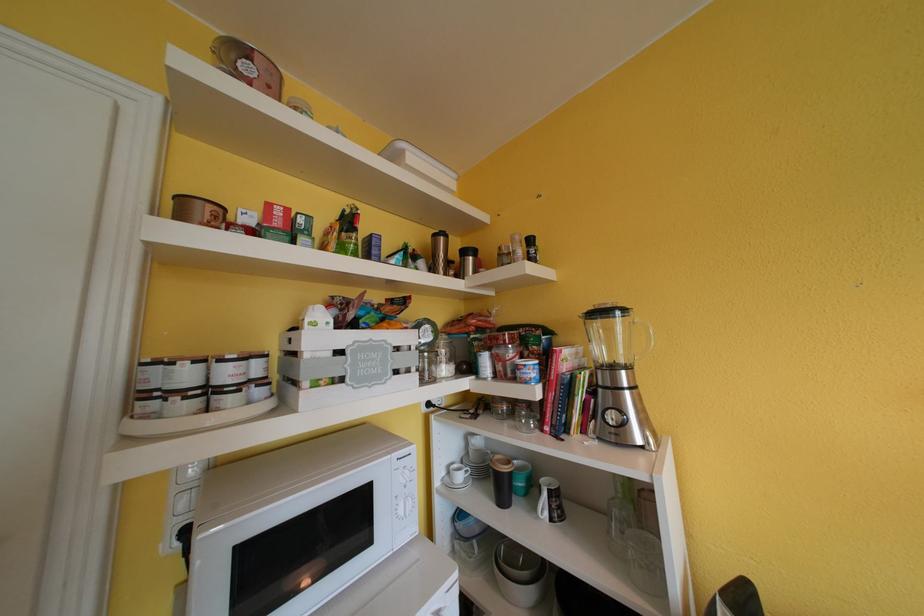
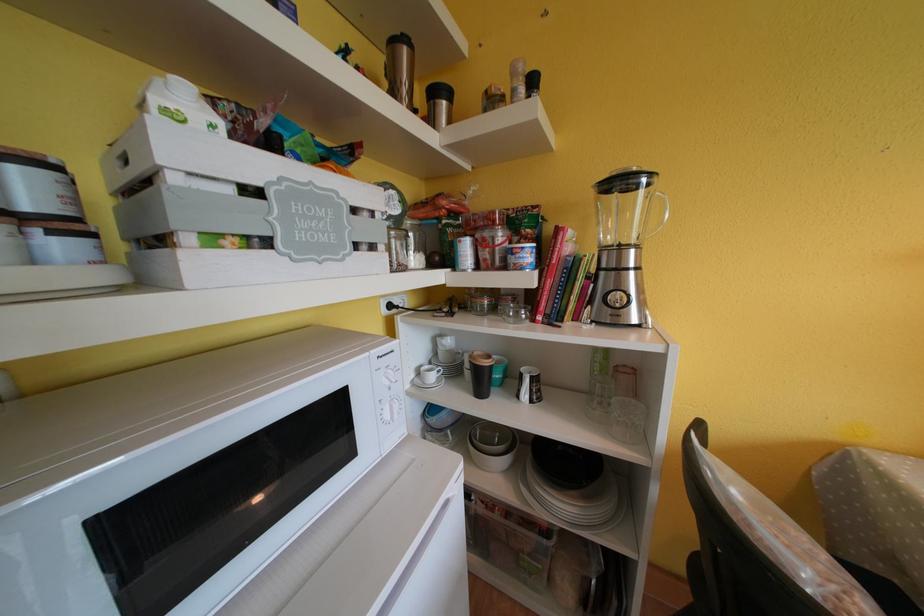
The point at [435,408] is marked in the first image. Where is the corresponding point in the second image?

(396, 310)